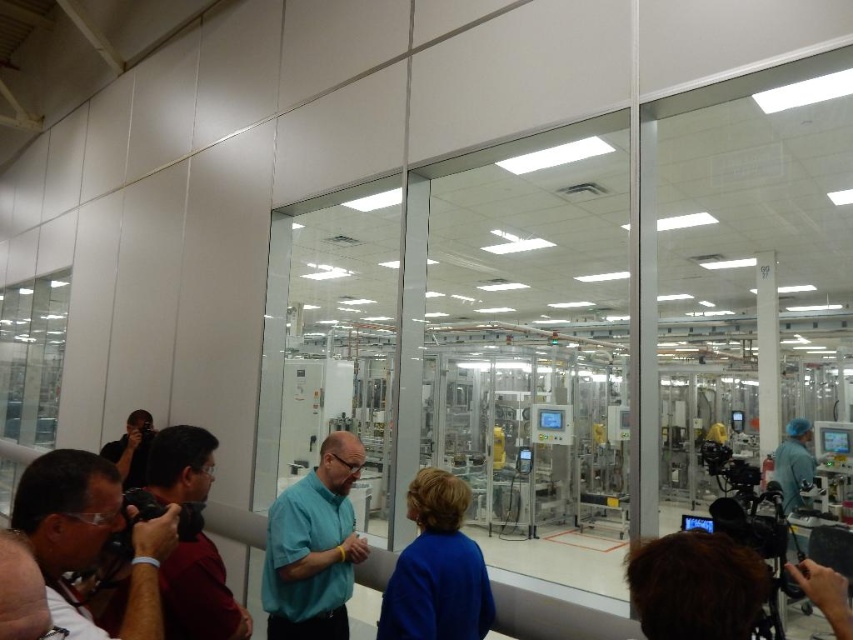
In the scene shown: You are a tour guide in the facility and need to choose a camera to hand to a visitor. The visitor prefers a smaller camera for easier handling. Which camera between the matte black camera at lower left and the matte black camera at left should you choose?

The matte black camera at lower left is smaller in size compared to the matte black camera at left, so you should choose the matte black camera at lower left for easier handling.

You are standing in the manufacturing facility and see the point marked at coordinate (90, 538). What object is located at that point?

The point at coordinate (90, 538) marks the location of the matte black camera at lower left.

You are a tour guide in the facility and want to ensure that the matte black camera at lower left and the matte teal shirt at center are visible in the group photo. Since the camera is smaller, where should you position them to ensure both are clearly visible?

Since the matte black camera at lower left has a lesser width compared to the matte teal shirt at center, you should position the matte black camera at lower left closer to the camera lens to ensure it appears larger in the photo, while keeping the matte teal shirt at center at a moderate distance for balance.